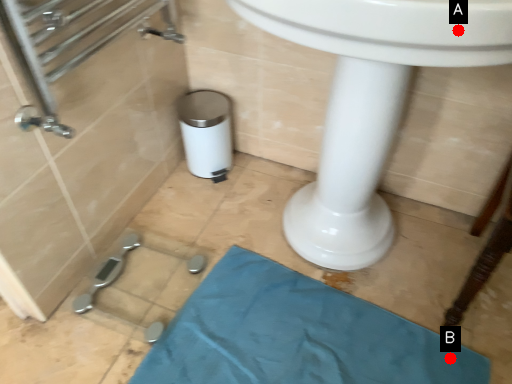
Question: Two points are circled on the image, labeled by A and B beside each circle. Among these points, which one is farthest from the camera?

Choices:
 (A) A is further
 (B) B is further

Answer: (B)